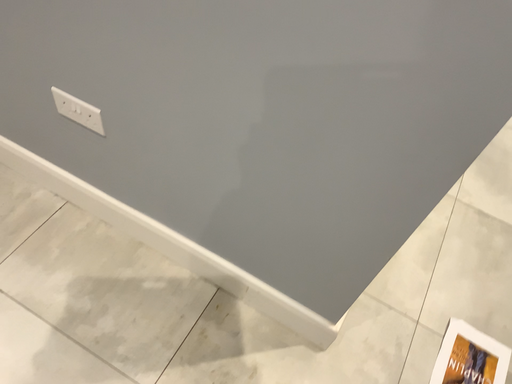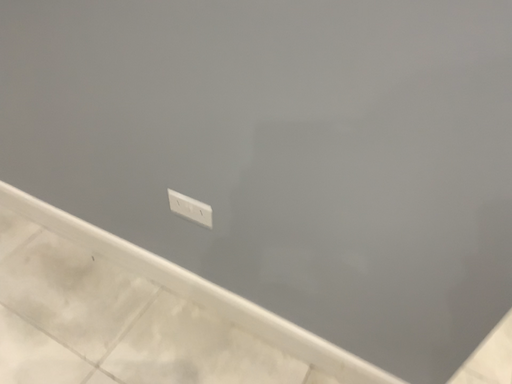
Question: Which way did the camera rotate in the video?

Choices:
 (A) rotated upward
 (B) rotated downward

Answer: (A)